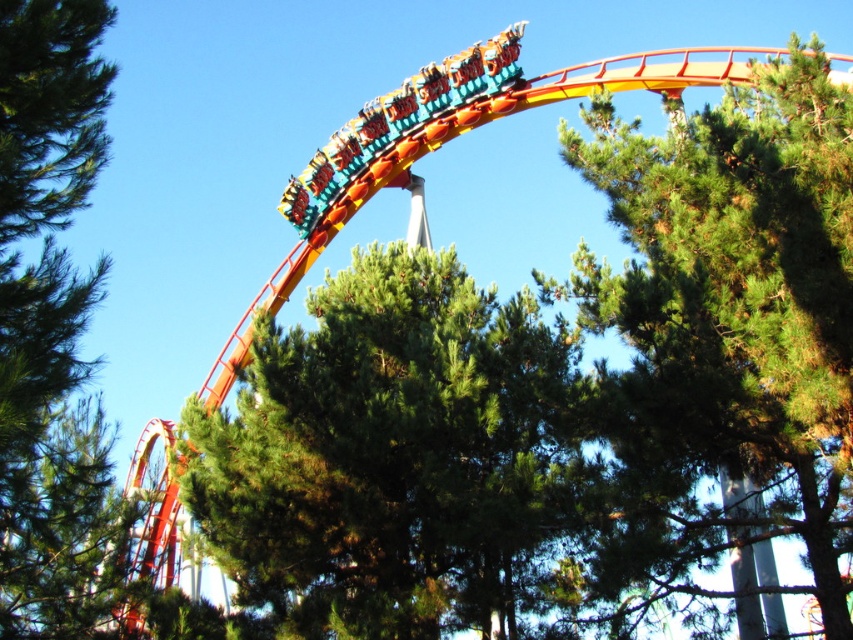
How much distance is there between green textured tree at center and green leafy tree at upper left?

green textured tree at center is 56.57 meters away from green leafy tree at upper left.

Which of these two, green textured tree at center or green leafy tree at upper left, stands shorter?

Standing shorter between the two is green textured tree at center.

The width and height of the screenshot is (853, 640). What do you see at coordinates (727, 326) in the screenshot? I see `green textured tree at center` at bounding box center [727, 326].

Locate an element on the screen. green textured tree at center is located at coordinates (727, 326).

In the scene shown: Which is more to the left, green needle-like foliage at center or green leafy tree at upper left?

green leafy tree at upper left is more to the left.

What do you see at coordinates (399, 458) in the screenshot? The image size is (853, 640). I see `green needle-like foliage at center` at bounding box center [399, 458].

You are a GUI agent. You are given a task and a screenshot of the screen. Output one action in this format:
    pyautogui.click(x=<x>, y=<y>)
    Task: Click on the green needle-like foliage at center
    
    Given the screenshot: What is the action you would take?
    pyautogui.click(x=399, y=458)

Who is taller, green needle-like foliage at center or green textured tree at center?

green textured tree at center is taller.

Does green needle-like foliage at center have a greater height compared to green textured tree at center?

No.

Between point (486, 432) and point (840, 424), which one is positioned in front?

Point (840, 424) is more forward.

Where is `green needle-like foliage at center`? green needle-like foliage at center is located at coordinates (399, 458).